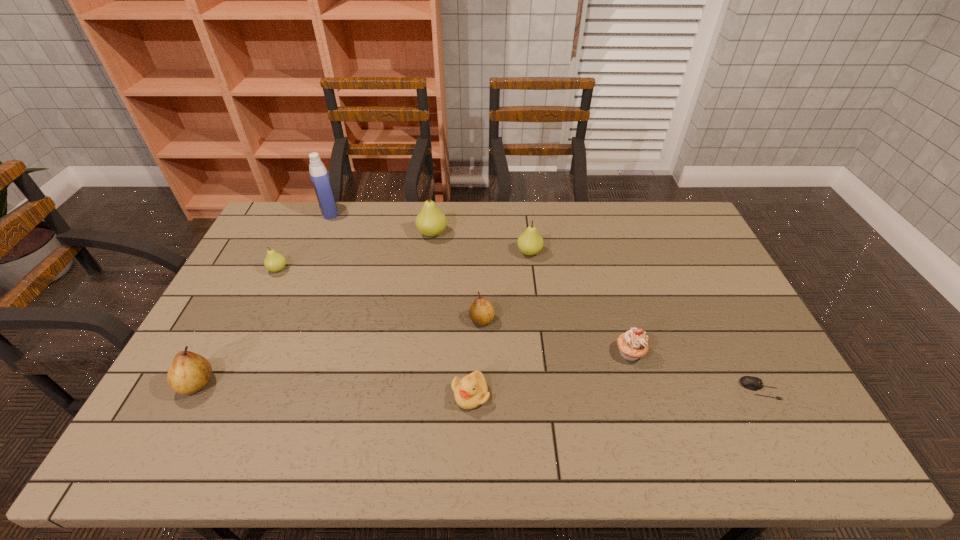
Find the location of a particular element. the smaller brown pear is located at coordinates (481, 312).

I want to click on the farther brown pear, so click(481, 312).

At what (x,y) coordinates should I click in order to perform the action: click on the second object from right to left. Please return your answer as a coordinate pair (x, y). This screenshot has height=540, width=960. Looking at the image, I should click on 633,345.

Find the location of a particular element. cupcake is located at coordinates (633, 345).

Locate an element on the screen. The height and width of the screenshot is (540, 960). duckling is located at coordinates (471, 391).

Find the location of a particular element. yellow duckling is located at coordinates (471, 391).

The height and width of the screenshot is (540, 960). I want to click on the rightmost object, so click(753, 383).

Find the location of a particular element. mouse is located at coordinates (753, 383).

Where is `free spot located on the right of the tallest object`? The width and height of the screenshot is (960, 540). free spot located on the right of the tallest object is located at coordinates (385, 211).

You are a GUI agent. You are given a task and a screenshot of the screen. Output one action in this format:
    pyautogui.click(x=<x>, y=<y>)
    Task: Click on the vacant position located on the back of the third pear from left to right
    
    Given the screenshot: What is the action you would take?
    pyautogui.click(x=435, y=208)